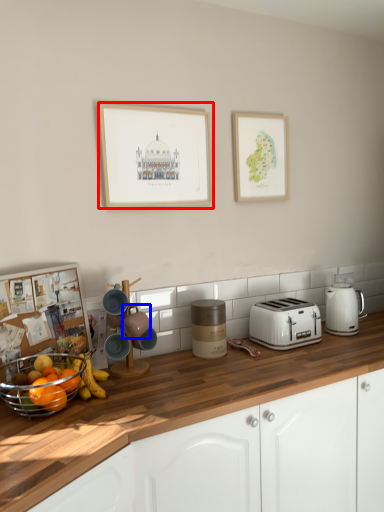
Question: Among these objects, which one is farthest to the camera, picture frame (highlighted by a red box) or appliance (highlighted by a blue box)?

Choices:
 (A) picture frame
 (B) appliance

Answer: (A)